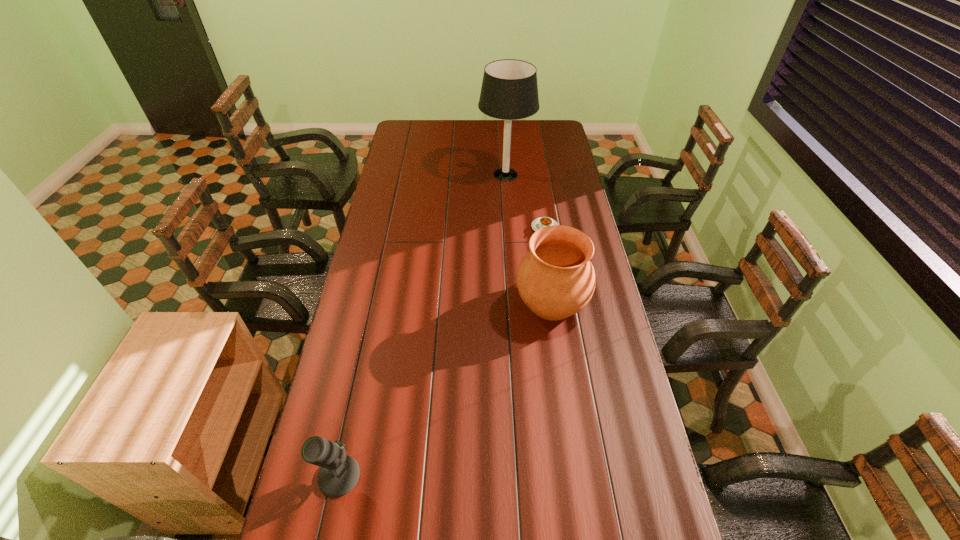
Identify which object is the third closest to the tallest object. Please provide its 2D coordinates. Your answer should be formatted as a tuple, i.e. [(x, y)], where the tuple contains the x and y coordinates of a point satisfying the conditions above.

[(339, 474)]

Image resolution: width=960 pixels, height=540 pixels. In order to click on vacant space that satisfies the following two spatial constraints: 1. on the back side of the third nearest object; 2. on the left side of the second tallest object in this screenshot , I will do `click(540, 227)`.

Identify the location of vacant position in the image that satisfies the following two spatial constraints: 1. on the front side of the tallest object; 2. on the left side of the third farthest object. (515, 301).